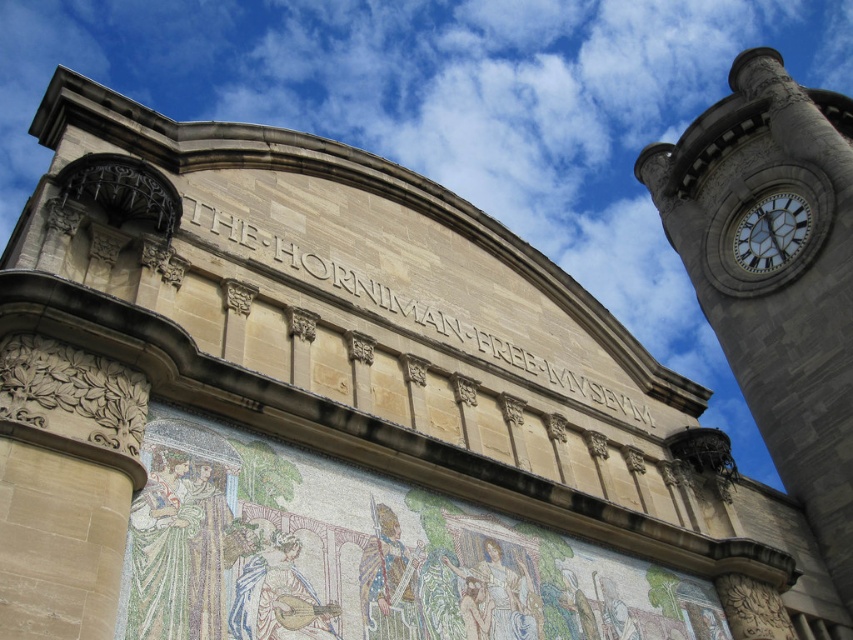
You are standing in front of the Horniman Free Museum and want to take a photo of the stone clock tower at upper right. Where should you position yourself to capture it in the frame?

The stone clock tower at upper right is located at point 2D coordinates of [775,273], so position yourself to the right side of the museum to capture it in the frame.

You are a visitor at the Horniman Free Museum and want to take a photo of the stone clock tower at upper right and the white glossy clock at upper right. Which one should you focus on to ensure it appears bigger in your photo?

The stone clock tower at upper right has a larger size compared to the white glossy clock at upper right, so you should focus on the stone clock tower at upper right to ensure it appears bigger in your photo.